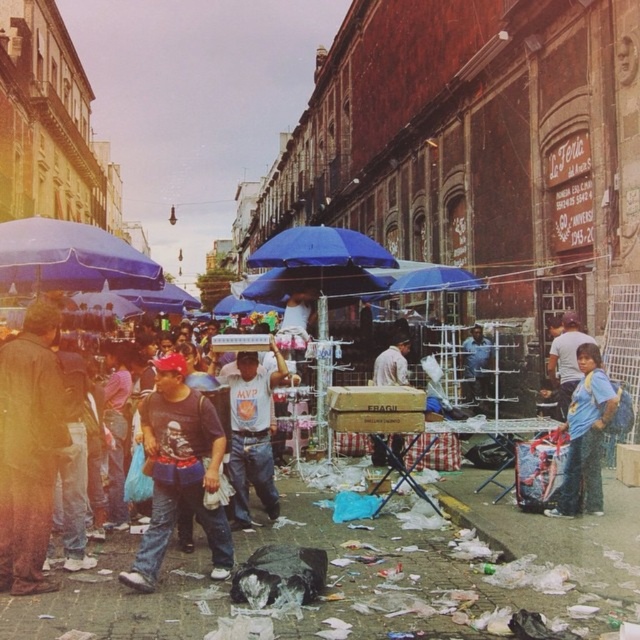
Can you confirm if dark blue jeans at center is thinner than blue fabric umbrella at left?

Indeed, dark blue jeans at center has a lesser width compared to blue fabric umbrella at left.

Who is higher up, dark blue jeans at center or blue fabric umbrella at left?

blue fabric umbrella at left

Is point (172, 356) more distant than point (80, 225)?

That is False.

Locate an element on the screen. This screenshot has width=640, height=640. dark blue jeans at center is located at coordinates (180, 474).

Does dark blue jeans at center appear on the left side of matte black t-shirt at center?

Indeed, dark blue jeans at center is positioned on the left side of matte black t-shirt at center.

Where is `dark blue jeans at center`? The height and width of the screenshot is (640, 640). dark blue jeans at center is located at coordinates (180, 474).

Does cardboard box at center appear on the left side of matte black t-shirt at center?

In fact, cardboard box at center is to the right of matte black t-shirt at center.

Can you confirm if cardboard box at center is shorter than matte black t-shirt at center?

Incorrect, cardboard box at center's height does not fall short of matte black t-shirt at center's.

Between point (305, 621) and point (157, 516), which one is positioned behind?

The point (157, 516) is more distant.

Find the location of a particular element. The width and height of the screenshot is (640, 640). cardboard box at center is located at coordinates (364, 563).